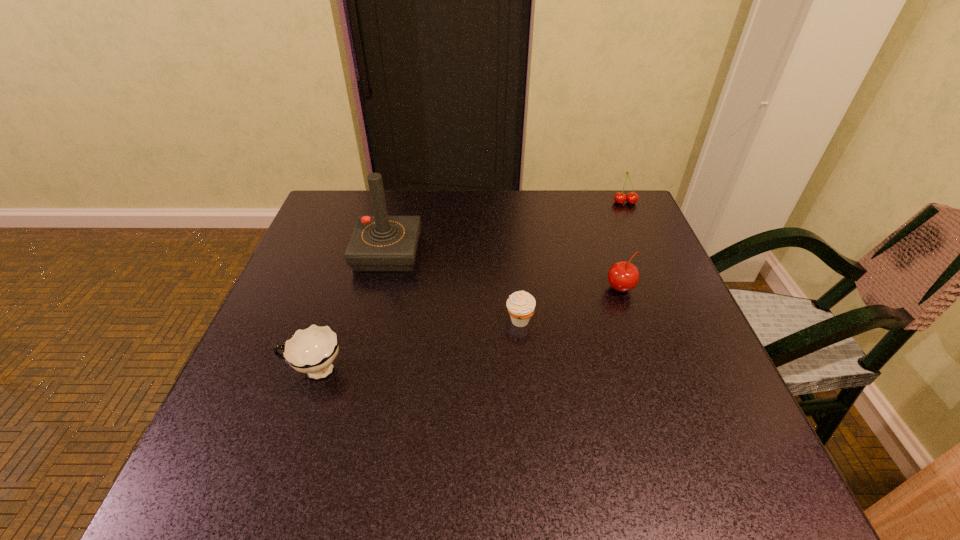
Locate an element on the screen. This screenshot has width=960, height=540. joystick is located at coordinates (380, 243).

At what (x,y) coordinates should I click in order to perform the action: click on the fourth nearest object. Please return your answer as a coordinate pair (x, y). Looking at the image, I should click on (380, 243).

At what (x,y) coordinates should I click in order to perform the action: click on the right cherry. Please return your answer as a coordinate pair (x, y). Looking at the image, I should click on click(x=632, y=197).

Where is `the farthest object`? the farthest object is located at coordinates (632, 197).

Locate an element on the screen. the nearer cherry is located at coordinates (623, 276).

This screenshot has height=540, width=960. I want to click on the fourth object from left to right, so pos(623,276).

The image size is (960, 540). Identify the location of the second nearest object. (520, 304).

At what (x,y) coordinates should I click in order to perform the action: click on the third object from right to left. Please return your answer as a coordinate pair (x, y). Looking at the image, I should click on (520, 304).

Locate an element on the screen. The height and width of the screenshot is (540, 960). cup is located at coordinates (312, 350).

At what (x,y) coordinates should I click in order to perform the action: click on free location located on the rectangular base of the joystick. Please return your answer as a coordinate pair (x, y). The height and width of the screenshot is (540, 960). Looking at the image, I should click on (353, 390).